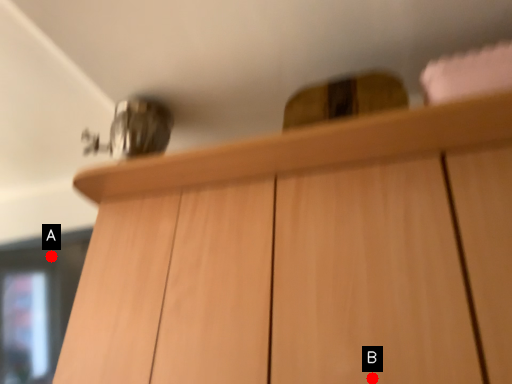
Question: Two points are circled on the image, labeled by A and B beside each circle. Which point is farther to the camera?

Choices:
 (A) A is further
 (B) B is further

Answer: (A)